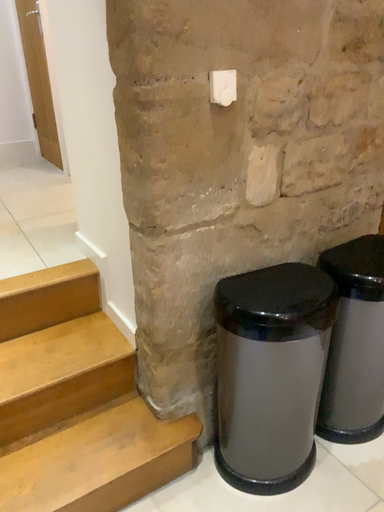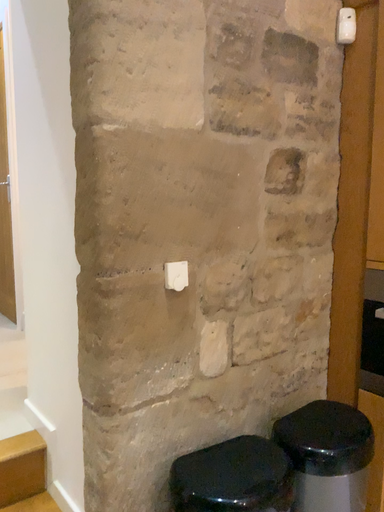
Question: Which way did the camera rotate in the video?

Choices:
 (A) rotated downward
 (B) rotated upward

Answer: (B)